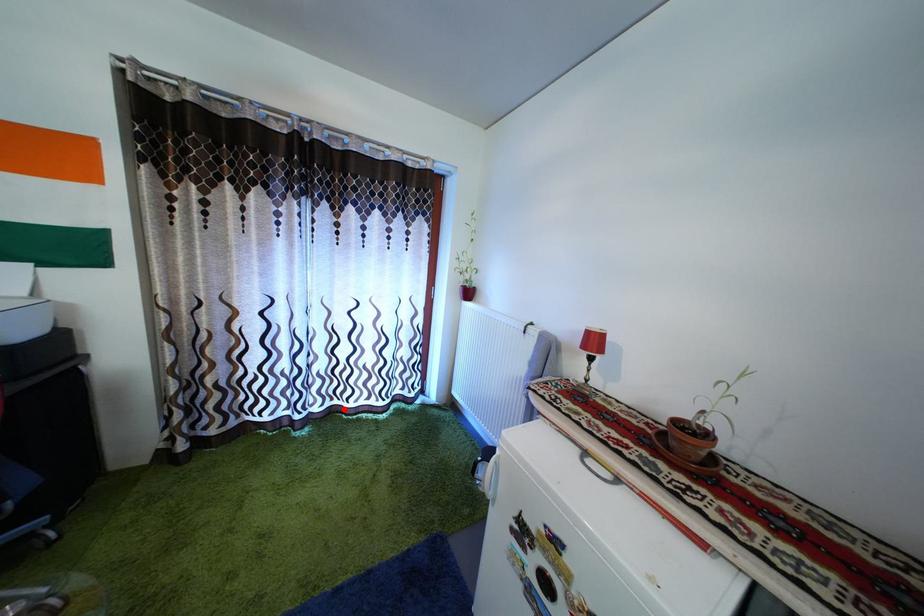
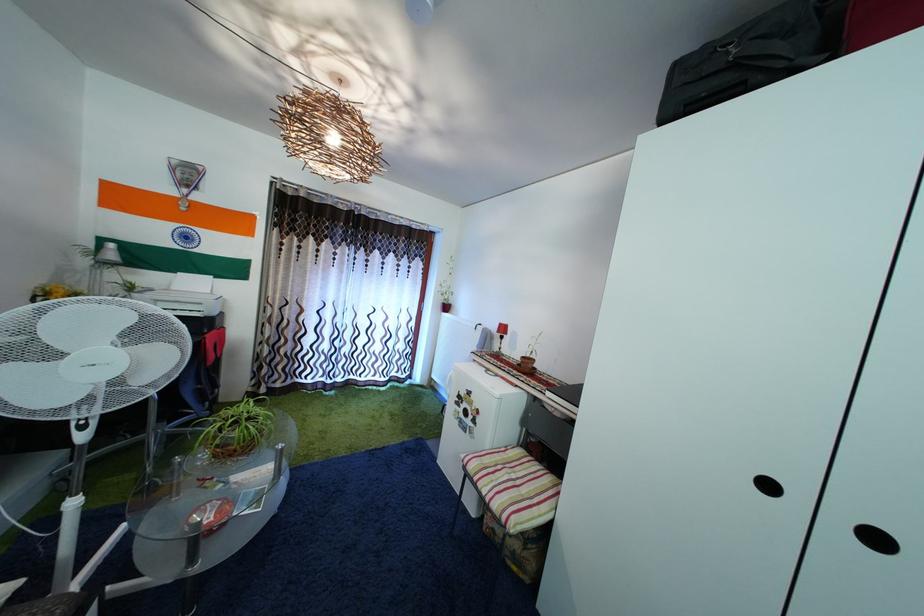
Where in the second image is the point corresponding to the highlighted location from the first image?

(359, 384)